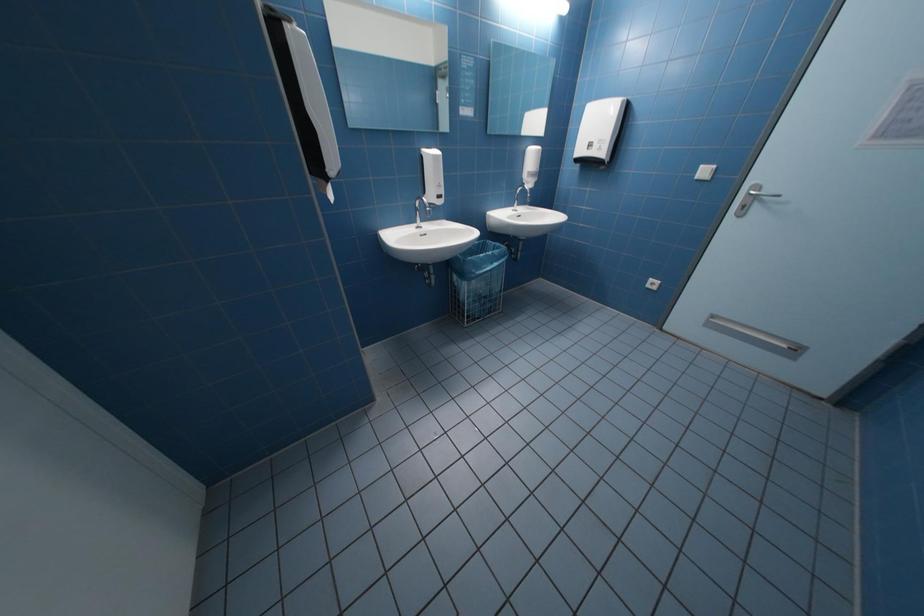
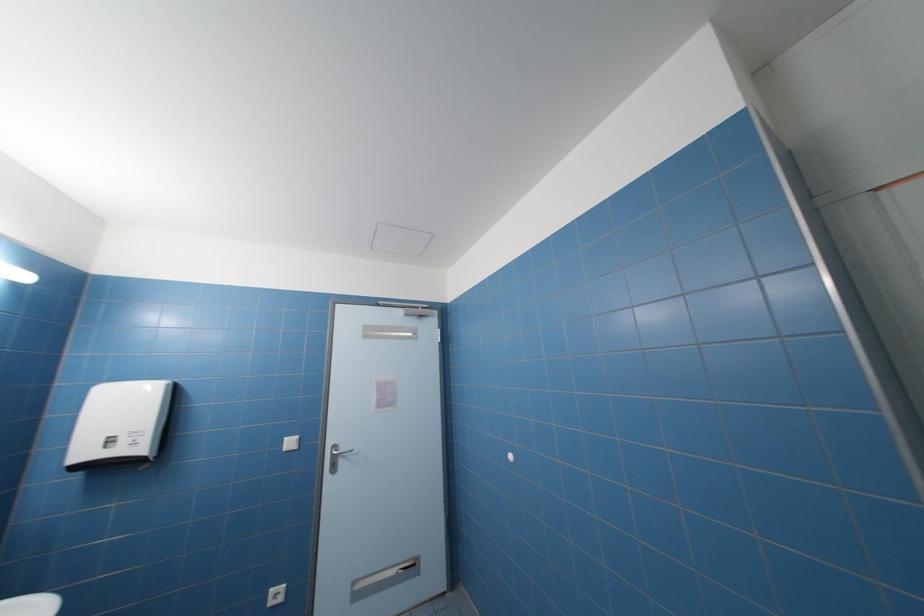
The first image is from the beginning of the video and the second image is from the end. How did the camera likely rotate when shooting the video?

The camera's rotation is toward right-up.